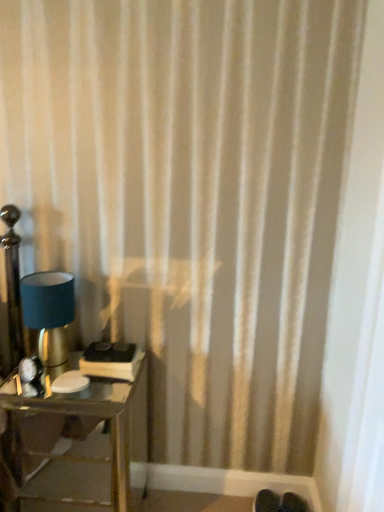
Question: Would you say matte blue fabric lampshade at left is to the left or to the right of metallic glass table at lower left in the picture?

Choices:
 (A) right
 (B) left

Answer: (B)

Question: From the image's perspective, relative to metallic glass table at lower left, is matte blue fabric lampshade at left above or below?

Choices:
 (A) below
 (B) above

Answer: (B)

Question: Is matte blue fabric lampshade at left inside or outside of metallic glass table at lower left?

Choices:
 (A) outside
 (B) inside

Answer: (A)

Question: Is metallic glass table at lower left taller or shorter than matte blue fabric lampshade at left?

Choices:
 (A) tall
 (B) short

Answer: (A)

Question: In terms of size, does metallic glass table at lower left appear bigger or smaller than matte blue fabric lampshade at left?

Choices:
 (A) big
 (B) small

Answer: (A)

Question: Considering their positions, is metallic glass table at lower left located in front of or behind matte blue fabric lampshade at left?

Choices:
 (A) front
 (B) behind

Answer: (A)

Question: Considering the positions of metallic glass table at lower left and matte blue fabric lampshade at left in the image, is metallic glass table at lower left wider or thinner than matte blue fabric lampshade at left?

Choices:
 (A) wide
 (B) thin

Answer: (A)